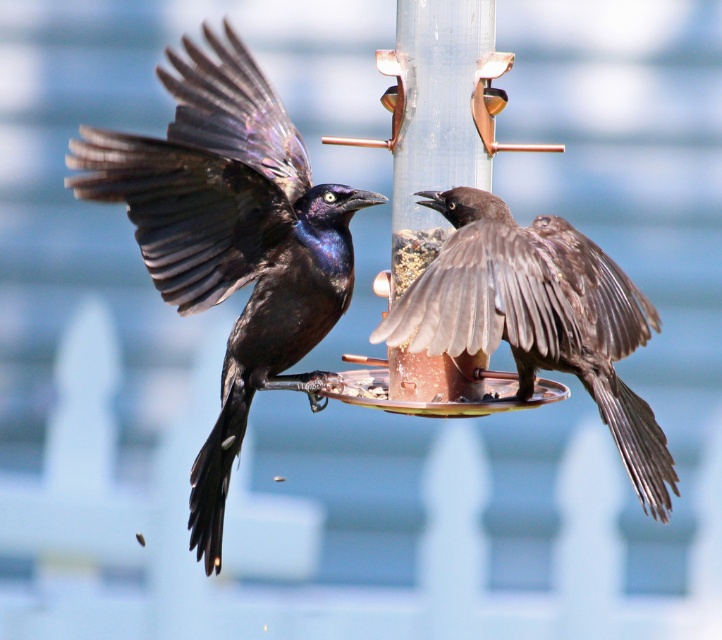
You are a birdwatcher observing the scene at the bird feeder. You notice the shiny black bird at left and the brown matte bird at center. Which bird would cast a bigger shadow if the sun is directly overhead?

The shiny black bird at left is larger in size than the brown matte bird at center, so it would cast a bigger shadow.

You are a photographer aiming to capture a clear photo of the shiny black bird at left and the copper metallic pole at center. Since the background is blurred, which object will appear more in focus in your photo?

The shiny black bird at left will appear more in focus because it is in front of the copper metallic pole at center, and the shallow depth of field blurs objects further away.